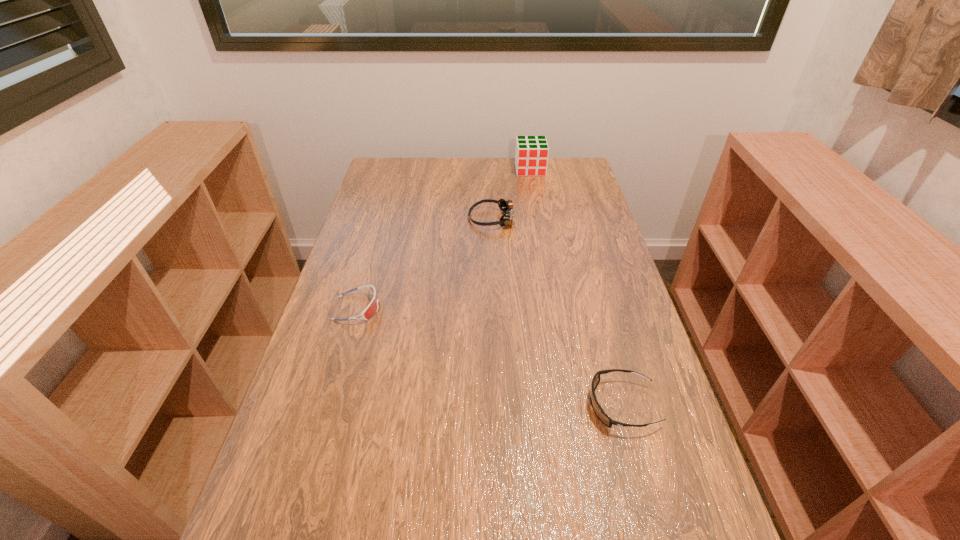
Locate an element on the screen. Image resolution: width=960 pixels, height=540 pixels. free space located 0.110m through the lenses of the second farthest object is located at coordinates (436, 219).

The image size is (960, 540). I want to click on vacant position located through the lenses of the second farthest object, so click(357, 219).

Identify the location of vacant point located on the lenses of the nearest goggles. Image resolution: width=960 pixels, height=540 pixels. (493, 405).

The height and width of the screenshot is (540, 960). What are the coordinates of `vacant area situated on the lenses of the nearest goggles` in the screenshot? It's located at (530, 405).

Locate an element on the screen. vacant space located on the lenses of the nearest goggles is located at coordinates (462, 405).

Find the location of a particular element. The image size is (960, 540). free space located on the front-facing side of the third farthest object is located at coordinates (432, 308).

You are a GUI agent. You are given a task and a screenshot of the screen. Output one action in this format:
    pyautogui.click(x=<x>, y=<y>)
    Task: Click on the object present at the far edge
    The height and width of the screenshot is (540, 960).
    Given the screenshot: What is the action you would take?
    pyautogui.click(x=531, y=155)

Image resolution: width=960 pixels, height=540 pixels. I want to click on object that is at the left edge, so click(x=371, y=309).

Where is `cube at the right edge`? Image resolution: width=960 pixels, height=540 pixels. cube at the right edge is located at coordinates (531, 155).

Image resolution: width=960 pixels, height=540 pixels. In order to click on goggles at the right edge in this screenshot , I will do `click(602, 416)`.